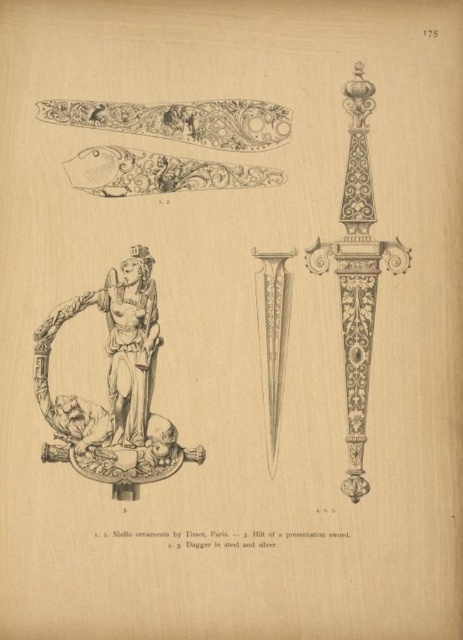
You are an art conservator working on a project to display two silver daggers from a historical collection. The daggers are the etched silver dagger at center and the polished silver dagger at center. The museum requires that each displayed item must be at least 15 feet apart for visitor safety. Based on the illustration provided, will the current spacing between these two daggers meet the museum requirement?

The etched silver dagger at center and the polished silver dagger at center are 17.19 feet apart from each other, which exceeds the required 15 feet distance. Therefore, the current spacing meets the museum requirement.

You are an art conservator examining the page from the publication. You need to inspect both the etched silver dagger at center and the polished silver dagger at center. Which one should you examine first without moving your head?

You should examine the etched silver dagger at center first because it is closer to the viewer than the polished silver dagger at center.

You are an art conservator working in a museum. You need to move the polished silver dagger at center to a new display case located 10 meters away from its current position. The polished bronze statue at center is fixed in place and cannot be moved. Can you safely transport the dagger to the new location without getting too close to the statue?

The polished bronze statue at center is 8.81 meters away from the polished silver dagger at center. Since the new display case is 10 meters away from the dagger, the total distance between the statue and the new case would be 8.81 meters plus the dagger moved 10 meters. Wait, actually, the dagger is being moved 10 meters away from its current position, so the distance from the statue would now be 8.81 meters plus 10 meters? No, that depends on direction. If moving directly away from the statue, the new 10m,